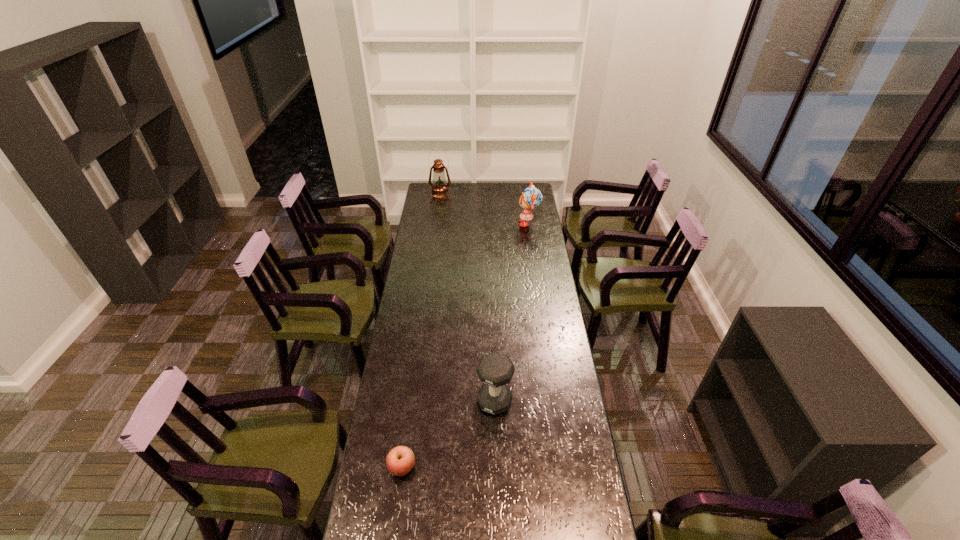
Find the location of a particular element. The height and width of the screenshot is (540, 960). the tallest object is located at coordinates (439, 189).

Locate an element on the screen. The height and width of the screenshot is (540, 960). oil lamp is located at coordinates (439, 189).

This screenshot has width=960, height=540. I want to click on the rightmost object, so click(531, 198).

Identify the location of doll. This screenshot has height=540, width=960. (531, 198).

Locate an element on the screen. This screenshot has width=960, height=540. the third farthest object is located at coordinates (495, 370).

The image size is (960, 540). In order to click on dumbbell in this screenshot , I will do `click(495, 370)`.

Find the location of a particular element. The image size is (960, 540). the nearest object is located at coordinates (400, 460).

You are a GUI agent. You are given a task and a screenshot of the screen. Output one action in this format:
    pyautogui.click(x=<x>, y=<y>)
    Task: Click on the apple
    Image resolution: width=960 pixels, height=540 pixels.
    Given the screenshot: What is the action you would take?
    pyautogui.click(x=400, y=460)

This screenshot has width=960, height=540. I want to click on free space located on the right of the oil lamp, so click(x=464, y=193).

Find the location of `vacant space located on the face of the doll`. vacant space located on the face of the doll is located at coordinates (483, 223).